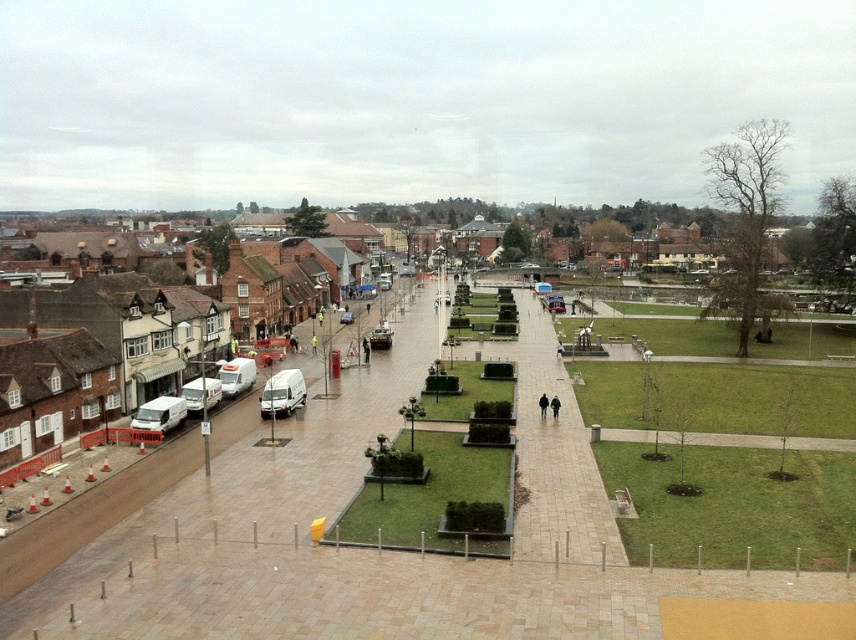
You are standing at the point labeled as point (x=375, y=552) in the image. Based on the scene description, what type of surface are you currently standing on?

The point (x=375, y=552) represents the smooth concrete plaza at center, so you are standing on a smooth concrete surface.